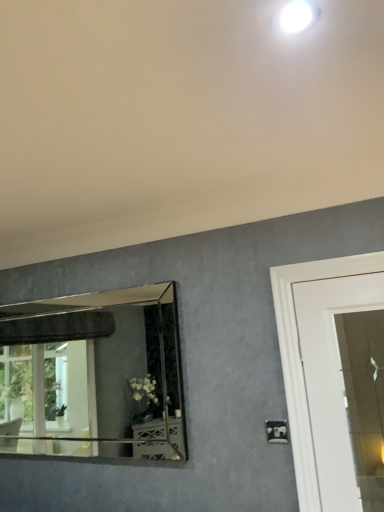
Question: In terms of width, does white glossy droplight at upper center look wider or thinner when compared to white plastic light switch at lower right?

Choices:
 (A) wide
 (B) thin

Answer: (A)

Question: From a real-world perspective, is white glossy droplight at upper center physically located above or below white plastic light switch at lower right?

Choices:
 (A) below
 (B) above

Answer: (B)

Question: Estimate the real-world distances between objects in this image. Which object is closer to the silver-framed mirror at left?

Choices:
 (A) white glossy droplight at upper center
 (B) white plastic light switch at lower right

Answer: (B)

Question: Which object is positioned farthest from the white plastic light switch at lower right?

Choices:
 (A) white glossy droplight at upper center
 (B) silver-framed mirror at left

Answer: (B)